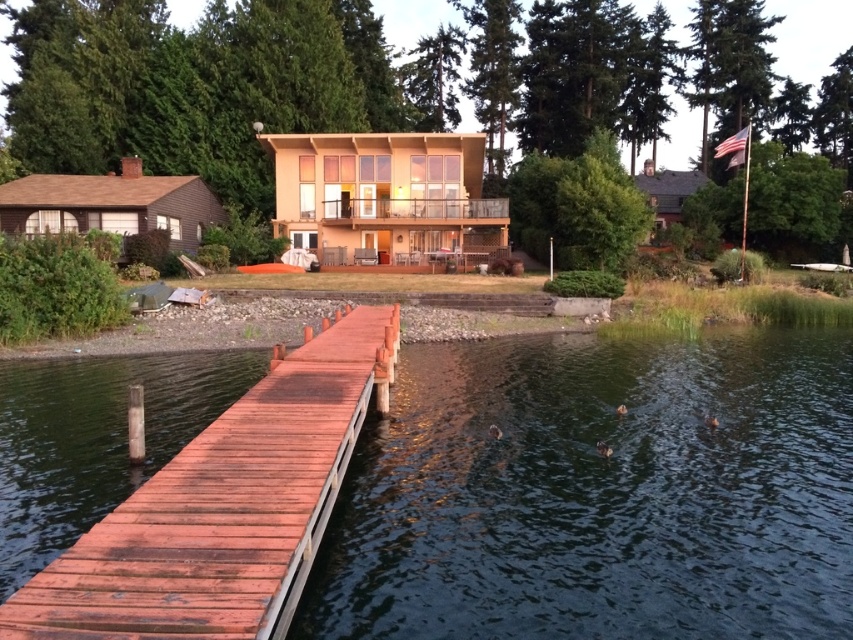
Question: Is dark blue water at lower center closer to the viewer compared to smooth reddish-brown wooden dock at center?

Choices:
 (A) no
 (B) yes

Answer: (A)

Question: Among these objects, which one is farthest from the camera?

Choices:
 (A) smooth reddish-brown wooden dock at center
 (B) dark blue water at lower center

Answer: (B)

Question: Where is dark blue water at lower center located in relation to smooth reddish-brown wooden dock at center in the image?

Choices:
 (A) above
 (B) below

Answer: (B)

Question: Can you confirm if dark blue water at lower center is positioned to the left of smooth reddish-brown wooden dock at center?

Choices:
 (A) yes
 (B) no

Answer: (B)

Question: Which of the following is the closest to the observer?

Choices:
 (A) smooth reddish-brown wooden dock at center
 (B) dark blue water at lower center

Answer: (A)